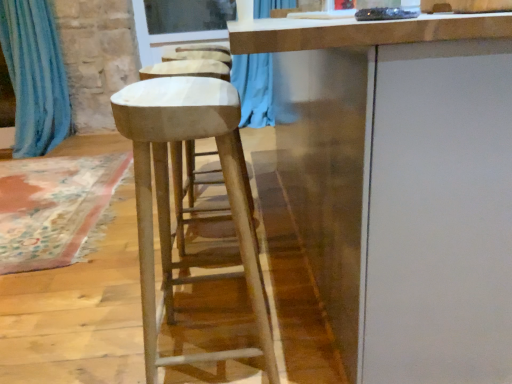
Question: Is smooth white stool at center at the right side of blue fabric curtain at left?

Choices:
 (A) no
 (B) yes

Answer: (B)

Question: Is smooth white stool at center to the left of blue fabric curtain at left from the viewer's perspective?

Choices:
 (A) no
 (B) yes

Answer: (A)

Question: Does smooth white stool at center have a larger size compared to blue fabric curtain at left?

Choices:
 (A) yes
 (B) no

Answer: (A)

Question: Does smooth white stool at center have a smaller size compared to blue fabric curtain at left?

Choices:
 (A) no
 (B) yes

Answer: (A)

Question: Is smooth white stool at center oriented away from blue fabric curtain at left?

Choices:
 (A) no
 (B) yes

Answer: (A)

Question: Is smooth white stool at center closer to camera compared to blue fabric curtain at left?

Choices:
 (A) yes
 (B) no

Answer: (A)

Question: From the image's perspective, is smooth white stool at center on top of white matte cabinet at center?

Choices:
 (A) yes
 (B) no

Answer: (B)

Question: Is smooth white stool at center to the left of white matte cabinet at center from the viewer's perspective?

Choices:
 (A) yes
 (B) no

Answer: (A)

Question: Is smooth white stool at center positioned behind white matte cabinet at center?

Choices:
 (A) yes
 (B) no

Answer: (A)

Question: Could you tell me if smooth white stool at center is turned towards white matte cabinet at center?

Choices:
 (A) yes
 (B) no

Answer: (A)

Question: Is smooth white stool at center wider than white matte cabinet at center?

Choices:
 (A) no
 (B) yes

Answer: (A)

Question: Considering the relative sizes of smooth white stool at center and white matte cabinet at center in the image provided, is smooth white stool at center thinner than white matte cabinet at center?

Choices:
 (A) yes
 (B) no

Answer: (A)

Question: Considering the relative positions of white matte cabinet at center and smooth white stool at center in the image provided, is white matte cabinet at center to the right of smooth white stool at center from the viewer's perspective?

Choices:
 (A) yes
 (B) no

Answer: (A)